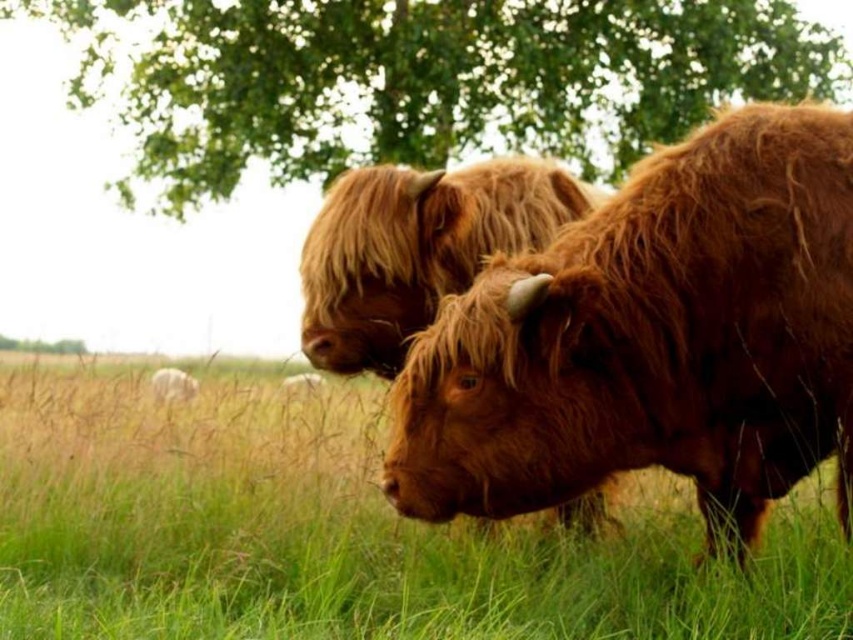
Question: Which point is farther from the camera taking this photo?

Choices:
 (A) (456, 172)
 (B) (439, 116)

Answer: (B)

Question: Can you confirm if green grassy at center is thinner than brown fuzzy cow at center?

Choices:
 (A) no
 (B) yes

Answer: (A)

Question: From the image, what is the correct spatial relationship of green grassy at center in relation to fuzzy brown yak at center?

Choices:
 (A) right
 (B) left

Answer: (B)

Question: Among these points, which one is farthest from the camera?

Choices:
 (A) (436, 564)
 (B) (157, 147)

Answer: (B)

Question: Is the position of green grassy at center less distant than that of fuzzy brown yak at center?

Choices:
 (A) yes
 (B) no

Answer: (A)

Question: Which object is farther from the camera taking this photo?

Choices:
 (A) fuzzy brown yak at center
 (B) green grassy at center
 (C) brown fuzzy cow at center
 (D) green leafy tree at upper center

Answer: (D)